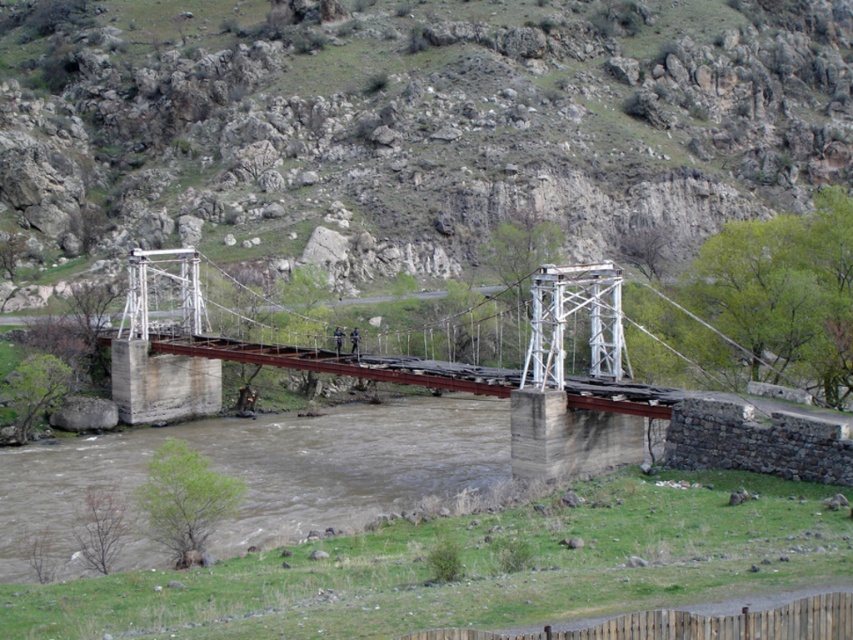
You are standing on the green grassy hillside at upper center and want to cross to the other side of the river. The rusty metal bridge at center is your only option. Can you see the entire bridge from your current position?

The rusty metal bridge at center is behind green grassy hillside at upper center, so you cannot see the entire bridge from your current position on the green grassy hillside at upper center because part of it is blocked by the hillside.

You are a hiker planning to cross the rusty metal bridge at center. From your current position on the green grassy hillside at upper center, which object is higher in elevation?

The green grassy hillside at upper center is taller than the rusty metal bridge at center, so the green grassy hillside at upper center is higher in elevation.

You are standing on the rusty metal bridge at center and want to reach the green grassy hillside at upper center. Which direction should you walk towards?

You should walk towards the right side of the rusty metal bridge at center to reach the green grassy hillside at upper center, as the green grassy hillside at upper center is located to the right of the rusty metal bridge at center.